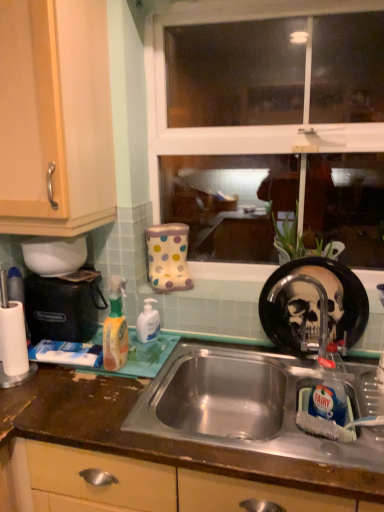
The height and width of the screenshot is (512, 384). What are the coordinates of `vacant area that lies in front of white matte toothpaste at lower left` in the screenshot? It's located at (54, 389).